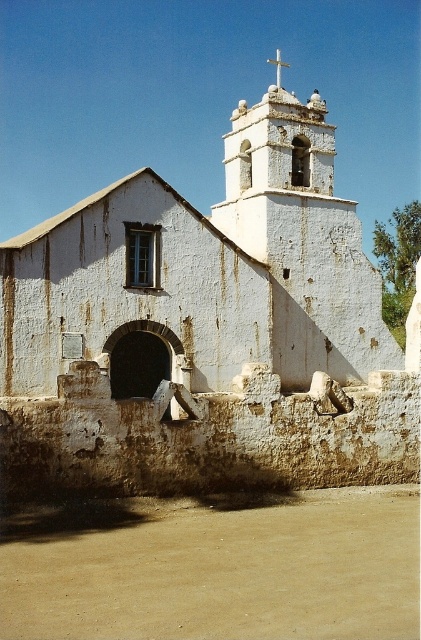
Can you confirm if brown sandy dirt at lower center is wider than white stone cross at upper center?

Yes.

Which is below, brown sandy dirt at lower center or white stone cross at upper center?

brown sandy dirt at lower center is below.

Who is more forward, (168, 572) or (268, 58)?

Positioned in front is point (168, 572).

You are a GUI agent. You are given a task and a screenshot of the screen. Output one action in this format:
    pyautogui.click(x=<x>, y=<y>)
    Task: Click on the brown sandy dirt at lower center
    
    Given the screenshot: What is the action you would take?
    pyautogui.click(x=215, y=566)

Between white plaster church at center and brown sandy dirt at lower center, which one appears on the right side from the viewer's perspective?

brown sandy dirt at lower center is more to the right.

Image resolution: width=421 pixels, height=640 pixels. I want to click on white plaster church at center, so click(207, 332).

Is white plaster church at center positioned behind white stone cross at upper center?

No, white plaster church at center is closer to the viewer.

Between white plaster church at center and white stone cross at upper center, which one appears on the right side from the viewer's perspective?

white stone cross at upper center

This screenshot has width=421, height=640. In order to click on white plaster church at center in this screenshot , I will do `click(207, 332)`.